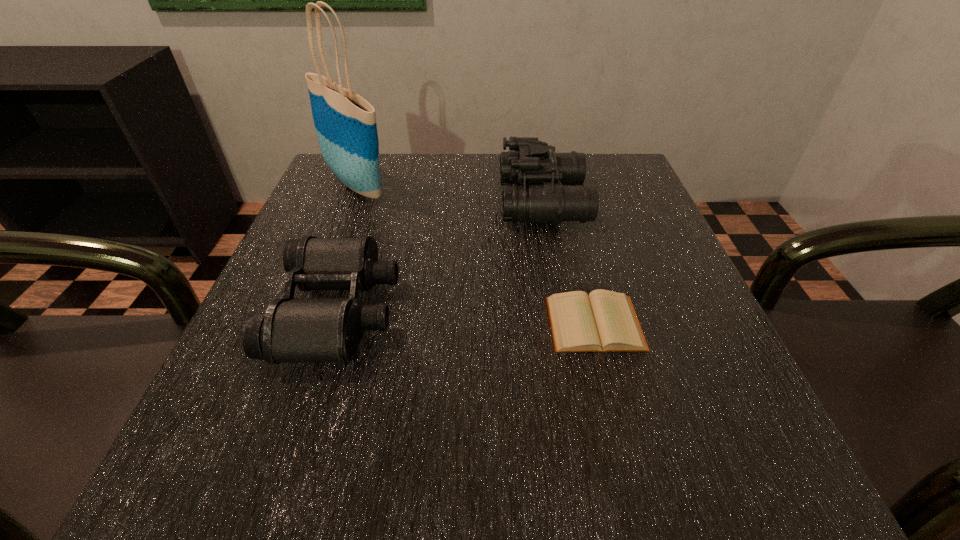
In the image, there is a desktop. Identify the location of vacant space at the far edge. (416, 190).

You are a GUI agent. You are given a task and a screenshot of the screen. Output one action in this format:
    pyautogui.click(x=<x>, y=<y>)
    Task: Click on the vacant space at the near edge of the desktop
    
    Given the screenshot: What is the action you would take?
    pyautogui.click(x=588, y=434)

The height and width of the screenshot is (540, 960). In the image, there is a desktop. In order to click on vacant area at the left edge in this screenshot , I will do `click(276, 267)`.

Where is `vacant space at the right edge of the desktop`? The width and height of the screenshot is (960, 540). vacant space at the right edge of the desktop is located at coordinates click(661, 241).

Locate an element on the screen. The height and width of the screenshot is (540, 960). vacant space at the far left corner of the desktop is located at coordinates (381, 173).

Identify the location of free space at the far right corner of the desktop. (614, 171).

I want to click on blank space at the near right corner of the desktop, so click(722, 443).

This screenshot has width=960, height=540. I want to click on vacant space that's between the tote bag and the diary, so click(x=476, y=254).

Image resolution: width=960 pixels, height=540 pixels. I want to click on free point between the second tallest object and the shortest object, so click(x=569, y=262).

The image size is (960, 540). What are the coordinates of `vacant space in between the diary and the tallest object` in the screenshot? It's located at (476, 254).